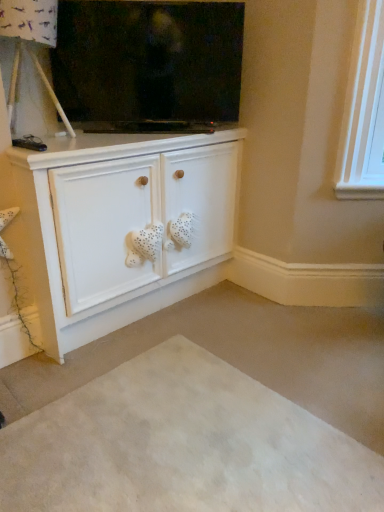
Question: Does white matte cabinet at center appear on the left side of beige carpet at lower center?

Choices:
 (A) yes
 (B) no

Answer: (A)

Question: From the image's perspective, is white matte cabinet at center on beige carpet at lower center?

Choices:
 (A) no
 (B) yes

Answer: (B)

Question: Is white matte cabinet at center aimed at beige carpet at lower center?

Choices:
 (A) yes
 (B) no

Answer: (A)

Question: Is white matte cabinet at center in front of beige carpet at lower center?

Choices:
 (A) no
 (B) yes

Answer: (A)

Question: Can you confirm if white matte cabinet at center is bigger than beige carpet at lower center?

Choices:
 (A) yes
 (B) no

Answer: (A)

Question: Can you confirm if white matte cabinet at center is taller than beige carpet at lower center?

Choices:
 (A) yes
 (B) no

Answer: (A)

Question: Is beige carpet at lower center next to flat screen tv at upper center?

Choices:
 (A) yes
 (B) no

Answer: (B)

Question: Is flat screen tv at upper center surrounded by beige carpet at lower center?

Choices:
 (A) yes
 (B) no

Answer: (B)

Question: Can you confirm if beige carpet at lower center is taller than flat screen tv at upper center?

Choices:
 (A) no
 (B) yes

Answer: (A)

Question: From the image's perspective, does beige carpet at lower center appear lower than flat screen tv at upper center?

Choices:
 (A) no
 (B) yes

Answer: (B)

Question: Can we say beige carpet at lower center lies outside flat screen tv at upper center?

Choices:
 (A) yes
 (B) no

Answer: (A)

Question: Considering the relative sizes of beige carpet at lower center and flat screen tv at upper center in the image provided, is beige carpet at lower center bigger than flat screen tv at upper center?

Choices:
 (A) yes
 (B) no

Answer: (B)

Question: Considering the relative sizes of beige carpet at lower center and white matte cabinet at center in the image provided, is beige carpet at lower center wider than white matte cabinet at center?

Choices:
 (A) no
 (B) yes

Answer: (B)